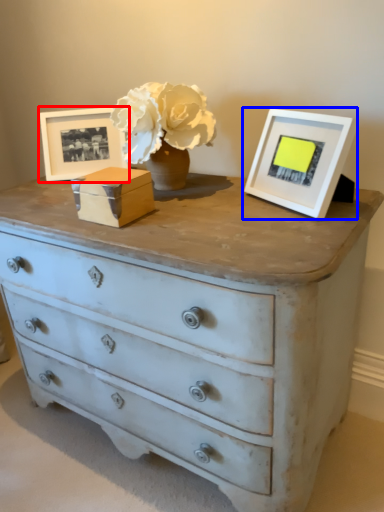
Question: Which of the following is the closest to the observer, picture frame (highlighted by a red box) or picture frame (highlighted by a blue box)?

Choices:
 (A) picture frame
 (B) picture frame

Answer: (B)